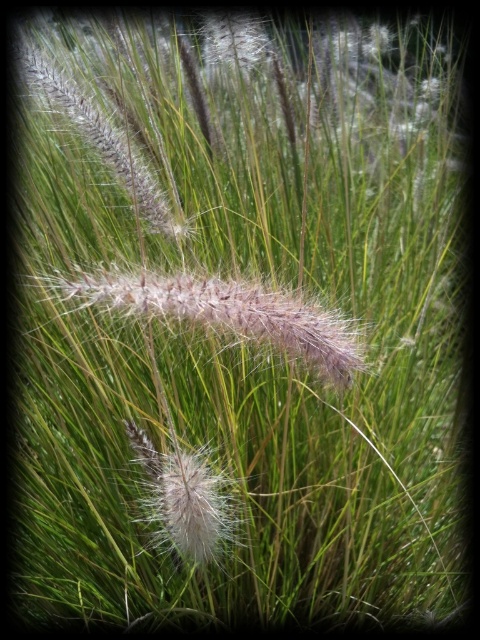
You are a photographer trying to capture the white fluffy flower at upper center and the fuzzy brown grass at center in a single shot. Based on their positions, which object should you adjust your camera to focus on first if you want to include both in your frame?

The fuzzy brown grass at center is positioned on the left side of white fluffy flower at upper center. To include both in the frame, you should adjust your camera to focus on the fuzzy brown grass at center first since it is closer to the left side and can be framed alongside the white fluffy flower at upper center.